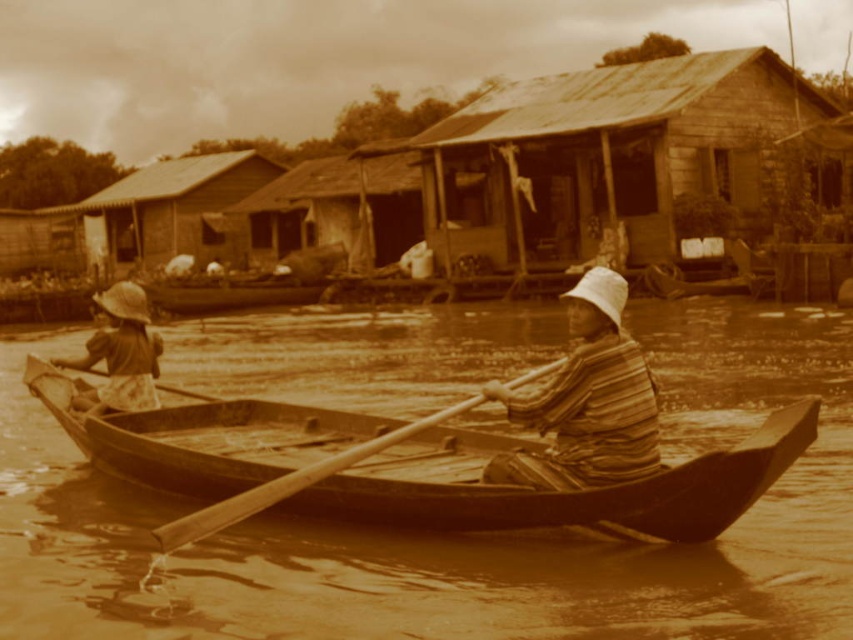
Question: Is the position of weathered wood houses at upper center less distant than that of rusty corrugated metal hut at center?

Choices:
 (A) yes
 (B) no

Answer: (A)

Question: Which object appears farthest from the camera in this image?

Choices:
 (A) wooden at center
 (B) rusty metal hut at center

Answer: (B)

Question: Estimate the real-world distances between objects in this image. Which object is closer to the rusty metal hut at center?

Choices:
 (A) wooden at center
 (B) rusty corrugated metal hut at center
 (C) matte straw hat at left

Answer: (B)

Question: Is matte straw hat at left in front of wooden at center?

Choices:
 (A) yes
 (B) no

Answer: (B)

Question: Estimate the real-world distances between objects in this image. Which object is farther from the wooden canoe at center?

Choices:
 (A) rustic wood hut at center
 (B) striped fabric hat at center

Answer: (A)

Question: Is rustic wood hut at center below rusty corrugated metal hut at center?

Choices:
 (A) yes
 (B) no

Answer: (B)